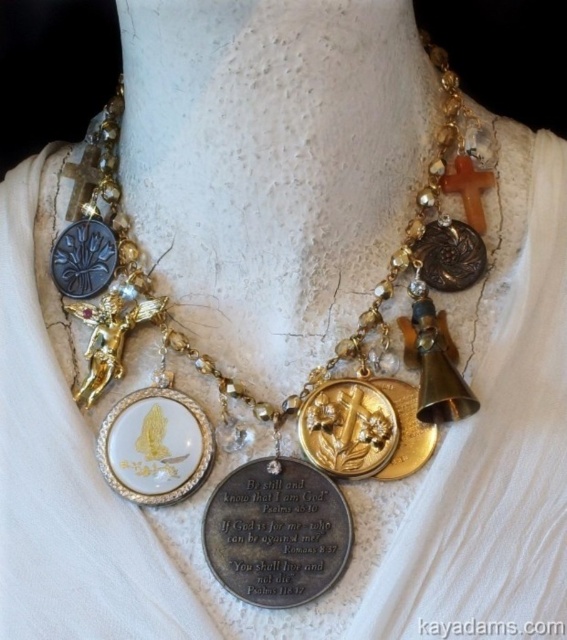
Between point (162, 321) and point (217, 513), which one is positioned in front?

Point (217, 513) is in front.

From the picture: Is gold metallic medallions at center shorter than silver metallic plaque at center?

In fact, gold metallic medallions at center may be taller than silver metallic plaque at center.

At what (x,y) coordinates should I click in order to perform the action: click on gold metallic medallions at center. Please return your answer as a coordinate pair (x, y). This screenshot has width=567, height=640. Looking at the image, I should click on (336, 344).

Is silver metallic plaque at center bigger than gold textured medallion at center?

Indeed, silver metallic plaque at center has a larger size compared to gold textured medallion at center.

Based on the photo, is silver metallic plaque at center wider than gold textured medallion at center?

Correct, the width of silver metallic plaque at center exceeds that of gold textured medallion at center.

The image size is (567, 640). What are the coordinates of `silver metallic plaque at center` in the screenshot? It's located at 277,532.

Is point (320, 406) closer to camera compared to point (475, 273)?

That is True.

Is point (354, 404) less distant than point (441, 266)?

Yes, point (354, 404) is closer to viewer.

Locate an element on the screen. gold textured cross at center is located at coordinates (348, 428).